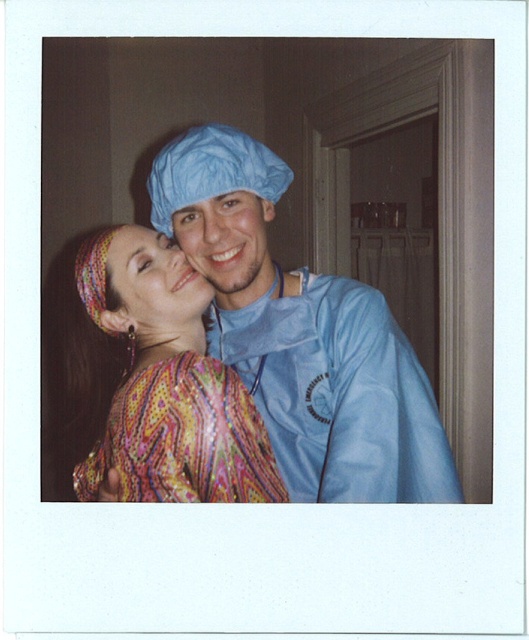
Which is above, multicolored patterned dress at center or multicolored fabric at center?

multicolored fabric at center

Does multicolored patterned dress at center appear on the left side of multicolored fabric at center?

Incorrect, multicolored patterned dress at center is not on the left side of multicolored fabric at center.

Is point (224, 456) positioned in front of point (167, 278)?

Yes.

At what (x,y) coordinates should I click in order to perform the action: click on multicolored patterned dress at center. Please return your answer as a coordinate pair (x, y). Looking at the image, I should click on (168, 385).

Which is above, blue matte surgical gown at center or blue fabric face at center?

blue fabric face at center is above.

Identify the location of blue matte surgical gown at center. The width and height of the screenshot is (529, 640). (300, 333).

Identify the location of blue matte surgical gown at center. This screenshot has width=529, height=640. (300, 333).

Does printed fabric dress at center appear on the right side of multicolored fabric at center?

No, printed fabric dress at center is not to the right of multicolored fabric at center.

At what (x,y) coordinates should I click in order to perform the action: click on printed fabric dress at center. Please return your answer as a coordinate pair (x, y). Image resolution: width=529 pixels, height=640 pixels. Looking at the image, I should click on (184, 438).

This screenshot has height=640, width=529. What do you see at coordinates (184, 438) in the screenshot?
I see `printed fabric dress at center` at bounding box center [184, 438].

Where is `printed fabric dress at center`? Image resolution: width=529 pixels, height=640 pixels. printed fabric dress at center is located at coordinates 184,438.